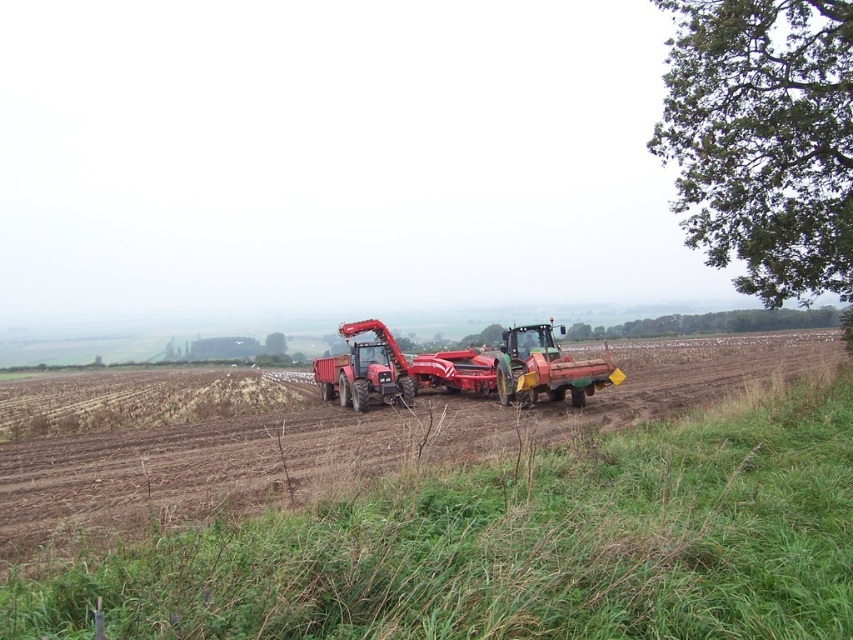
Question: Can you confirm if green grass at lower right is positioned below green matte tractor at center?

Choices:
 (A) no
 (B) yes

Answer: (B)

Question: Which point is farther from the camera taking this photo?

Choices:
 (A) (608, 376)
 (B) (189, 627)
 (C) (347, 369)

Answer: (C)

Question: Is green matte tractor at center in front of matte red tractor at center?

Choices:
 (A) no
 (B) yes

Answer: (B)

Question: Among these objects, which one is nearest to the camera?

Choices:
 (A) green grass at lower right
 (B) green matte tractor at center
 (C) matte red tractor at center

Answer: (A)

Question: Is green grass at lower right to the right of green matte tractor at center from the viewer's perspective?

Choices:
 (A) no
 (B) yes

Answer: (A)

Question: Which of the following is the closest to the observer?

Choices:
 (A) green grass at lower right
 (B) matte red tractor at center
 (C) green matte tractor at center

Answer: (A)